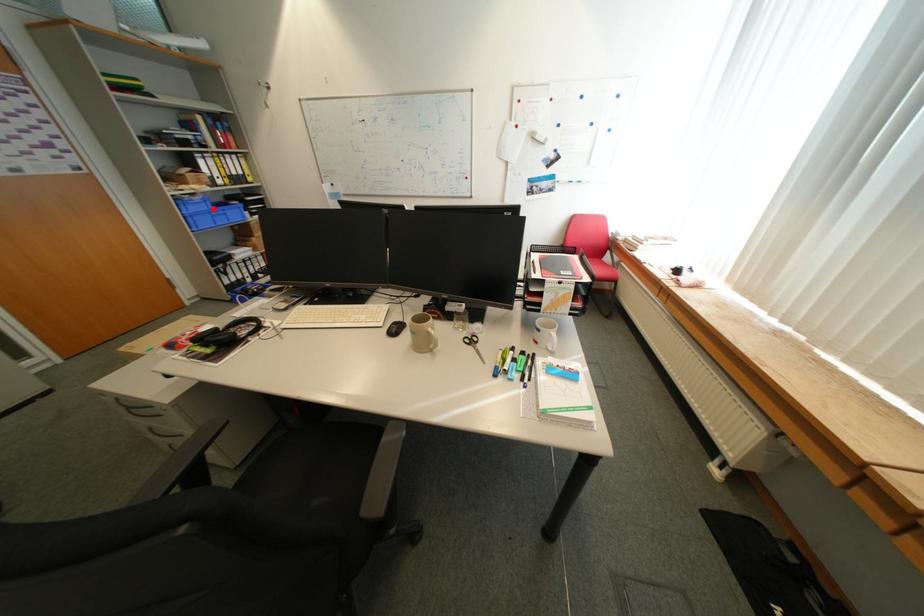
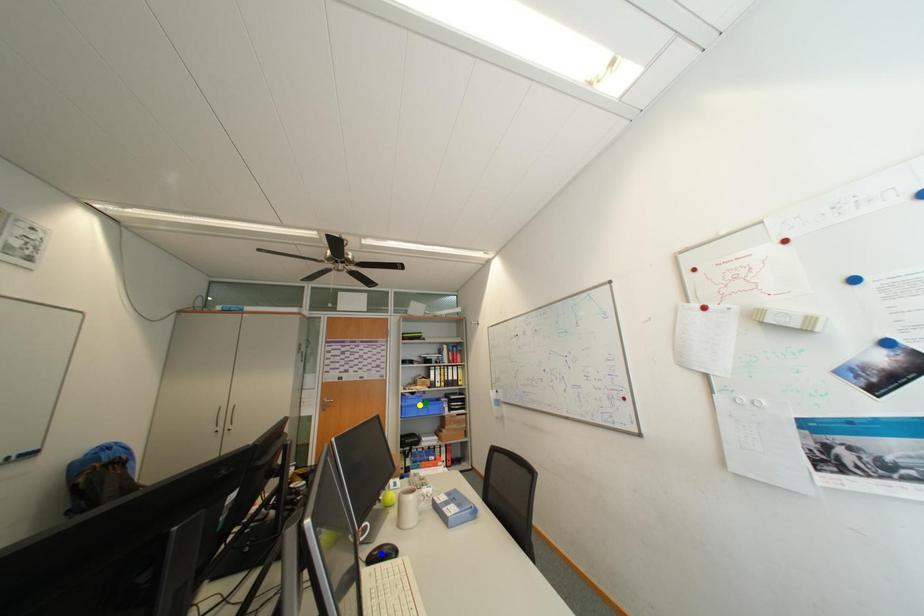
Question: I am providing you with two images of the same scene from different viewpoints. A red point is marked on the first image. You are given multiple points on the second image. Which point in image 2 is actually the same real-world point as the red point in image 1?

Choices:
 (A) green point
 (B) blue point
 (C) yellow point

Answer: (A)